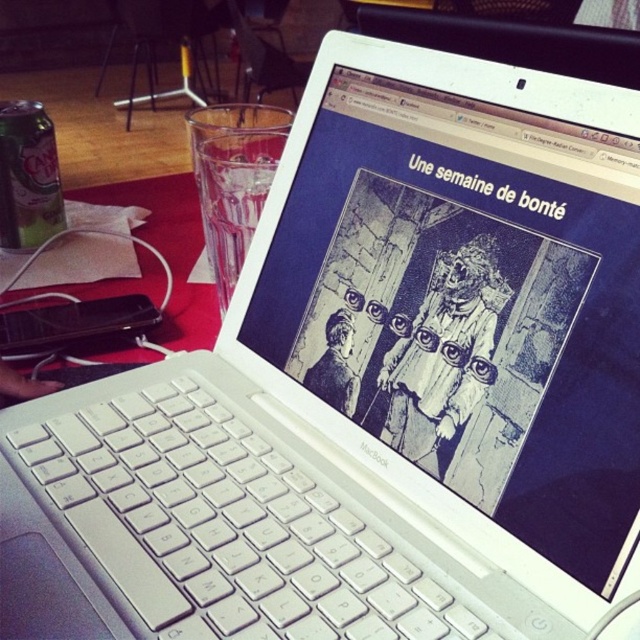
You are setting up a small table for a tea party. You have a red fabric table at lower left and a black paper bag at center. Where should you place the black paper bag relative to the red fabric table to match the scene?

The black paper bag at center should be placed to the right of the red fabric table at lower left, as the red fabric table at lower left is to the left of black paper bag at center.

You are organizing a small event and need to place a decorative item on the table. The table has limited space. You have the white plastic keyboard at center and the black paper doll at center. Which object is positioned lower on the table?

The white plastic keyboard at center is positioned lower on the table since it is below the black paper doll at center.

You are setting up a small display and need to place an item on the red fabric table at lower left. Based on the scene description, where exactly is the red fabric table positioned?

The red fabric table at lower left is located at point 0.395 on the x axis and 0.267 on the y axis.